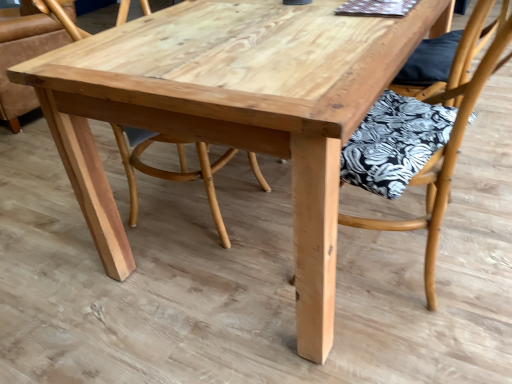
Question: Relative to wooden chair with floral cushion at center, the 1th chair from the front, is natural wood chair at center, which is counted as the 2th chair, starting from the front, in front or behind?

Choices:
 (A) front
 (B) behind

Answer: (B)

Question: Is natural wood chair at center, which ranks as the first chair in back-to-front order, situated inside wooden chair with floral cushion at center, the 1th chair from the front, or outside?

Choices:
 (A) inside
 (B) outside

Answer: (B)

Question: From the image's perspective, is natural wood chair at center, which ranks as the first chair in back-to-front order, above or below wooden chair with floral cushion at center, which ranks as the 2th chair in back-to-front order?

Choices:
 (A) above
 (B) below

Answer: (A)

Question: Considering the positions of wooden chair with floral cushion at center, which ranks as the 1th chair in right-to-left order, and natural wood chair at center, which ranks as the first chair in back-to-front order, in the image, is wooden chair with floral cushion at center, which ranks as the 1th chair in right-to-left order, wider or thinner than natural wood chair at center, which ranks as the first chair in back-to-front order,?

Choices:
 (A) thin
 (B) wide

Answer: (A)

Question: From the image's perspective, relative to natural wood chair at center, which appears as the 2th chair when viewed from the right, is wooden chair with floral cushion at center, the 1th chair from the front, above or below?

Choices:
 (A) above
 (B) below

Answer: (B)

Question: Would you say wooden chair with floral cushion at center, which ranks as the 2th chair in back-to-front order, is to the left or to the right of natural wood chair at center, which ranks as the first chair in back-to-front order, in the picture?

Choices:
 (A) right
 (B) left

Answer: (A)

Question: Is wooden chair with floral cushion at center, which ranks as the 2th chair in back-to-front order, inside the boundaries of natural wood chair at center, which is counted as the 2th chair, starting from the front, or outside?

Choices:
 (A) outside
 (B) inside

Answer: (A)